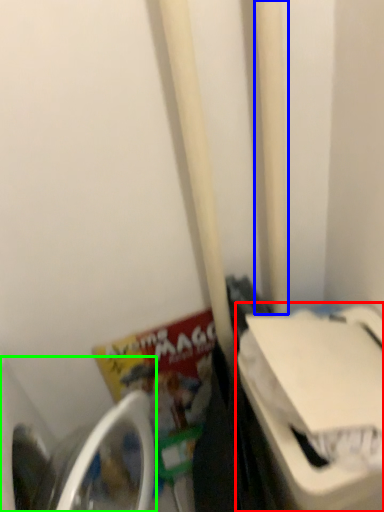
Question: Which object is positioned farthest from washing machine (highlighted by a red box)? Select from pole (highlighted by a blue box) and washing machine (highlighted by a green box).

Choices:
 (A) pole
 (B) washing machine

Answer: (B)